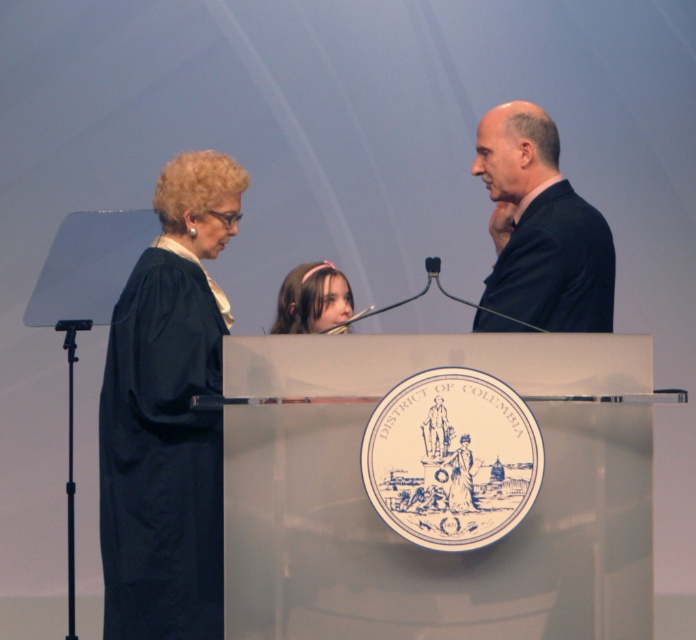
You are an event photographer at the formal event. You need to capture a closeup shot of the young girl in the center. The camera you are using has a narrow field of view. The point at coordinates (161, 452) marks the edge of the navy blue fabric robe at left. Based on this information, where should you position your camera to ensure the young girl in the center is fully visible in the frame?

The point at coordinates (161, 452) marks the edge of the navy blue fabric robe at left, so positioning the camera to focus on the young girl in the center would require centering the frame on her while ensuring the robe does not block the view. Since the robe is at the left edge marked by the point, the camera should be positioned to the right of this point to capture the young girl in the center without obstruction.